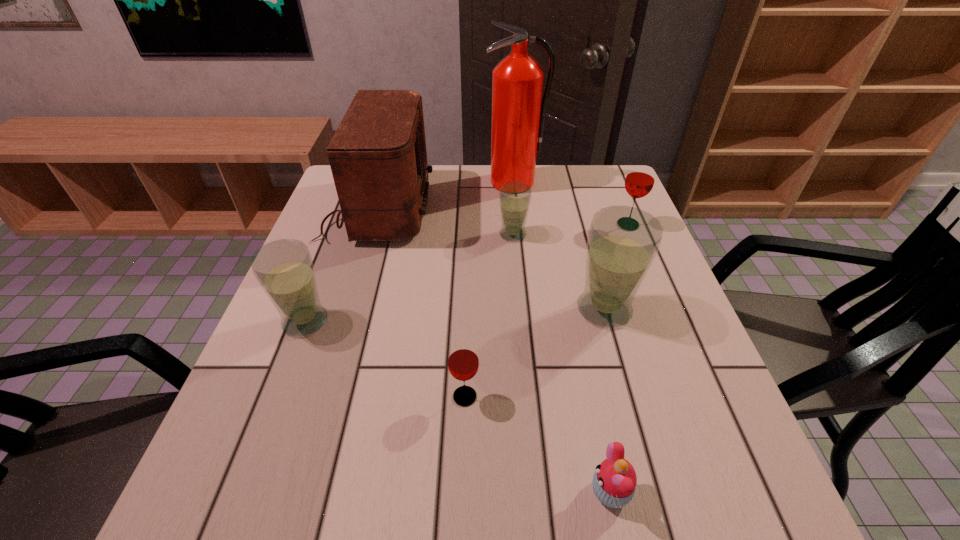
The image size is (960, 540). Find the location of `the farthest blue glass`. the farthest blue glass is located at coordinates (514, 197).

In order to click on the nearer red glass in this screenshot , I will do `click(463, 361)`.

Where is `the smaller red glass`? The height and width of the screenshot is (540, 960). the smaller red glass is located at coordinates (463, 361).

Where is `cupcake`? The height and width of the screenshot is (540, 960). cupcake is located at coordinates (614, 481).

Where is `the nearest object`? The width and height of the screenshot is (960, 540). the nearest object is located at coordinates 614,481.

The width and height of the screenshot is (960, 540). In order to click on free spot located at the nozzle of the fire extinguisher in this screenshot , I will do pyautogui.click(x=519, y=236).

You are a GUI agent. You are given a task and a screenshot of the screen. Output one action in this format:
    pyautogui.click(x=<x>, y=<y>)
    Task: Click on the free space located 0.370m on the front panel of the seventh shortest object
    
    Given the screenshot: What is the action you would take?
    pyautogui.click(x=564, y=208)

Locate an element on the screen. Image resolution: width=960 pixels, height=540 pixels. free spot located on the front of the sixth shortest object is located at coordinates (637, 428).

I want to click on free space located on the front of the right red glass, so click(643, 263).

Find the location of a particular element. This screenshot has height=540, width=960. free space located 0.190m on the front of the second biggest blue glass is located at coordinates (264, 428).